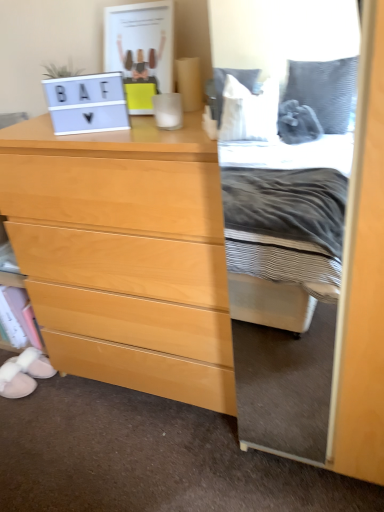
Question: Would you say matte white laptop at upper left is part of light wood chest of drawers at left's contents?

Choices:
 (A) yes
 (B) no

Answer: (B)

Question: Is light wood chest of drawers at left closer to the viewer compared to matte white laptop at upper left?

Choices:
 (A) no
 (B) yes

Answer: (B)

Question: Can we say light wood chest of drawers at left lies outside matte white laptop at upper left?

Choices:
 (A) yes
 (B) no

Answer: (A)

Question: Is light wood chest of drawers at left thinner than matte white laptop at upper left?

Choices:
 (A) yes
 (B) no

Answer: (B)

Question: Considering the relative sizes of light wood chest of drawers at left and matte white laptop at upper left in the image provided, is light wood chest of drawers at left bigger than matte white laptop at upper left?

Choices:
 (A) yes
 (B) no

Answer: (A)

Question: From the image's perspective, is light wood chest of drawers at left beneath matte white laptop at upper left?

Choices:
 (A) no
 (B) yes

Answer: (B)

Question: Is white suede slipper at lower left, which is the second shoe from back to front, completely or partially inside white fluffy slippers at lower left, acting as the 2th shoe starting from the front?

Choices:
 (A) no
 (B) yes

Answer: (A)

Question: Considering the relative positions of white fluffy slippers at lower left, acting as the 2th shoe starting from the front, and white suede slipper at lower left, acting as the first shoe starting from the front, in the image provided, is white fluffy slippers at lower left, acting as the 2th shoe starting from the front, to the left of white suede slipper at lower left, acting as the first shoe starting from the front, from the viewer's perspective?

Choices:
 (A) yes
 (B) no

Answer: (B)

Question: Considering the relative sizes of white fluffy slippers at lower left, acting as the 2th shoe starting from the front, and white suede slipper at lower left, which is the second shoe from back to front, in the image provided, is white fluffy slippers at lower left, acting as the 2th shoe starting from the front, smaller than white suede slipper at lower left, which is the second shoe from back to front,?

Choices:
 (A) yes
 (B) no

Answer: (A)

Question: Is white fluffy slippers at lower left, acting as the 2th shoe starting from the front, to the right of white suede slipper at lower left, acting as the first shoe starting from the front, from the viewer's perspective?

Choices:
 (A) no
 (B) yes

Answer: (B)

Question: Is the position of white fluffy slippers at lower left, positioned as the first shoe in back-to-front order, less distant than that of white suede slipper at lower left, which is the second shoe from back to front?

Choices:
 (A) no
 (B) yes

Answer: (A)

Question: From a real-world perspective, is white fluffy slippers at lower left, acting as the 2th shoe starting from the front, positioned over white suede slipper at lower left, which is the second shoe from back to front, based on gravity?

Choices:
 (A) no
 (B) yes

Answer: (B)

Question: Can you confirm if white fluffy slippers at lower left, acting as the 2th shoe starting from the front, is bigger than light wood chest of drawers at left?

Choices:
 (A) yes
 (B) no

Answer: (B)